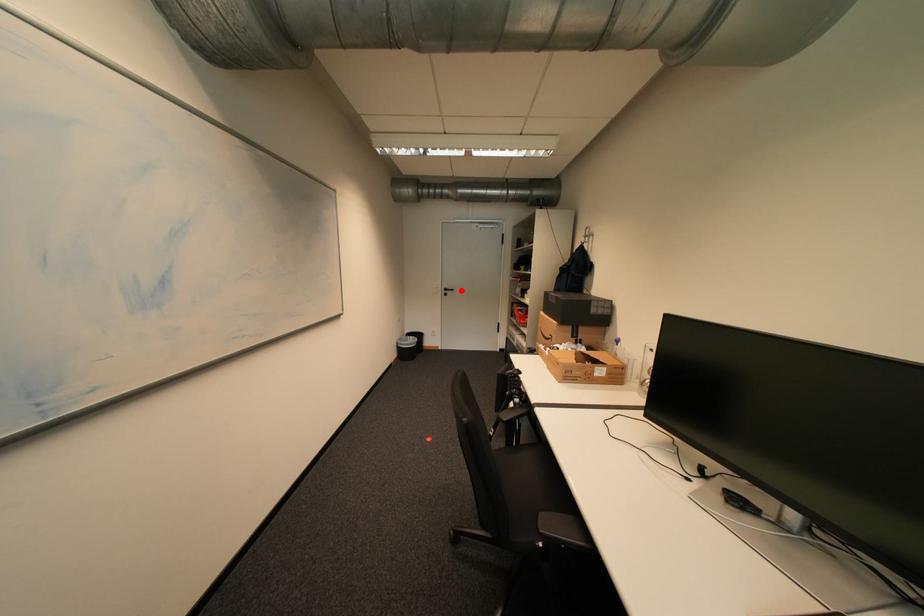
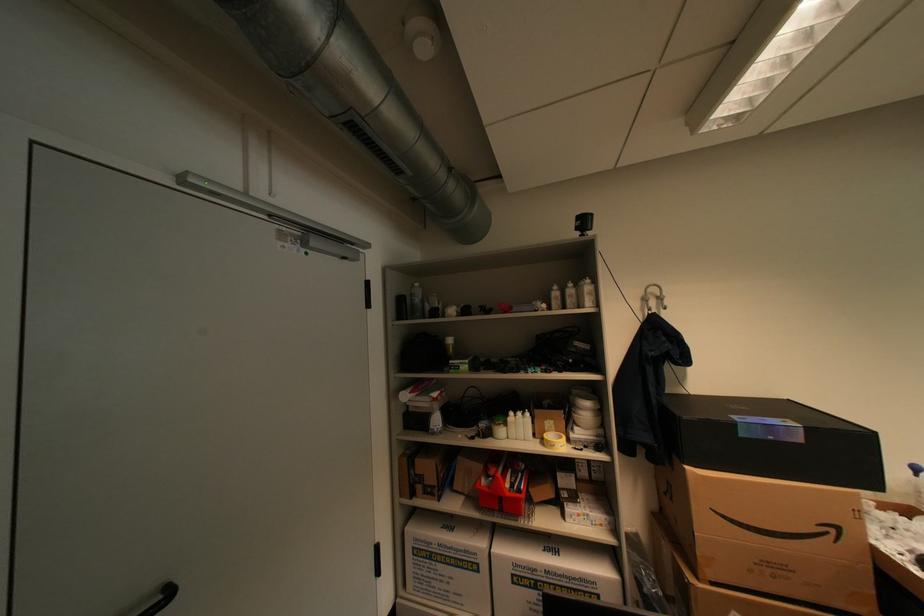
Question: I am providing you with two images of the same scene from different viewpoints. A red point is marked on the first image. Can you still see the location of the red point in image 2?

Choices:
 (A) Yes
 (B) No

Answer: (A)